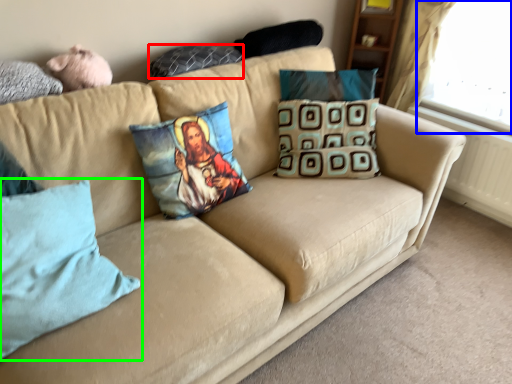
Question: Estimate the real-world distances between objects in this image. Which object is closer to pillow (highlighted by a red box), window screen (highlighted by a blue box) or pillow (highlighted by a green box)?

Choices:
 (A) window screen
 (B) pillow

Answer: (B)